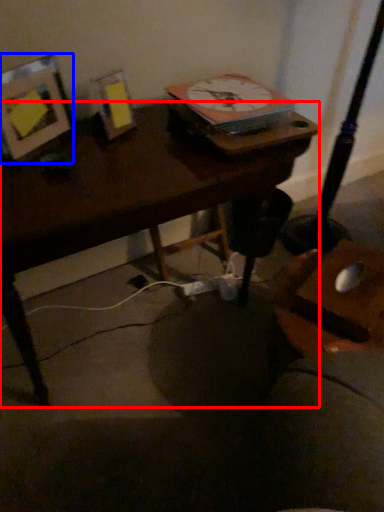
Question: Which object is further to the camera taking this photo, desk (highlighted by a red box) or picture frame (highlighted by a blue box)?

Choices:
 (A) desk
 (B) picture frame

Answer: (B)